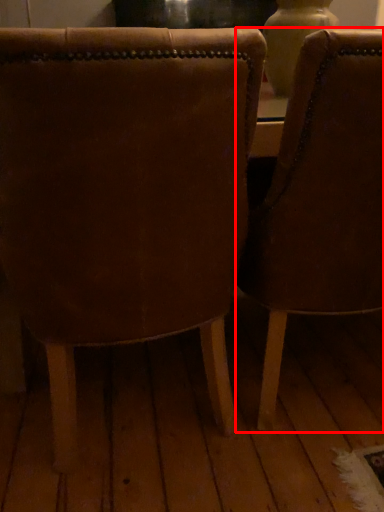
Question: From the image's perspective, what is the correct spatial positioning of chair (annotated by the red box) in reference to chair?

Choices:
 (A) below
 (B) above

Answer: (B)